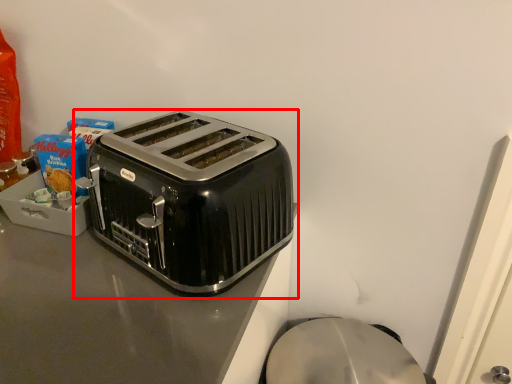
Question: In this image, where is toaster (annotated by the red box) located relative to counter top?

Choices:
 (A) left
 (B) right

Answer: (B)